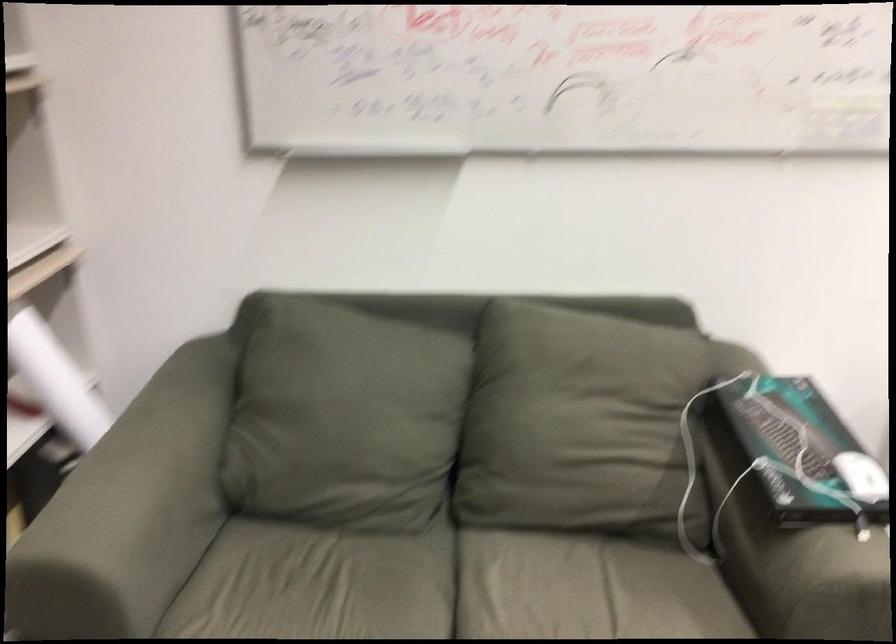
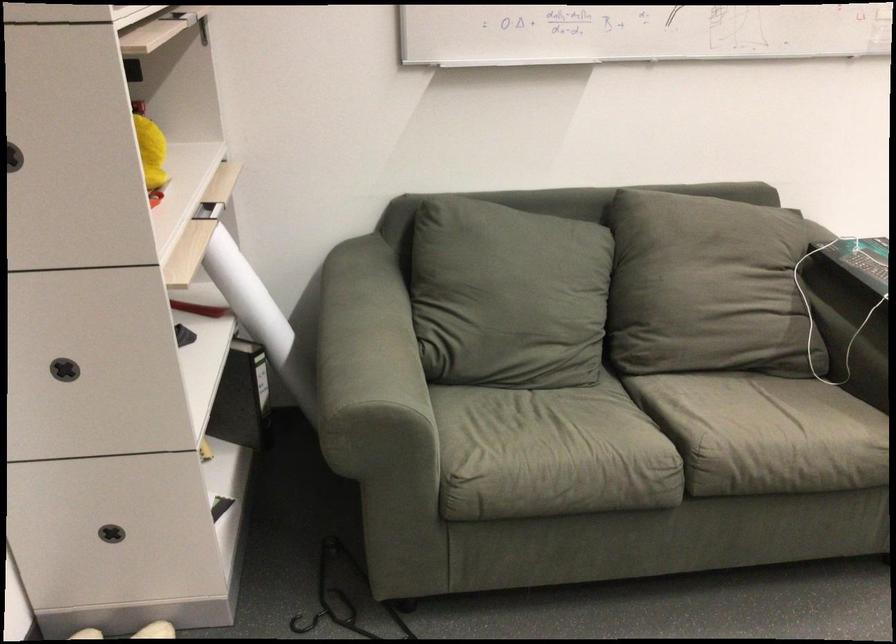
Find the pixel in the second image that matches point (333, 420) in the first image.

(506, 295)